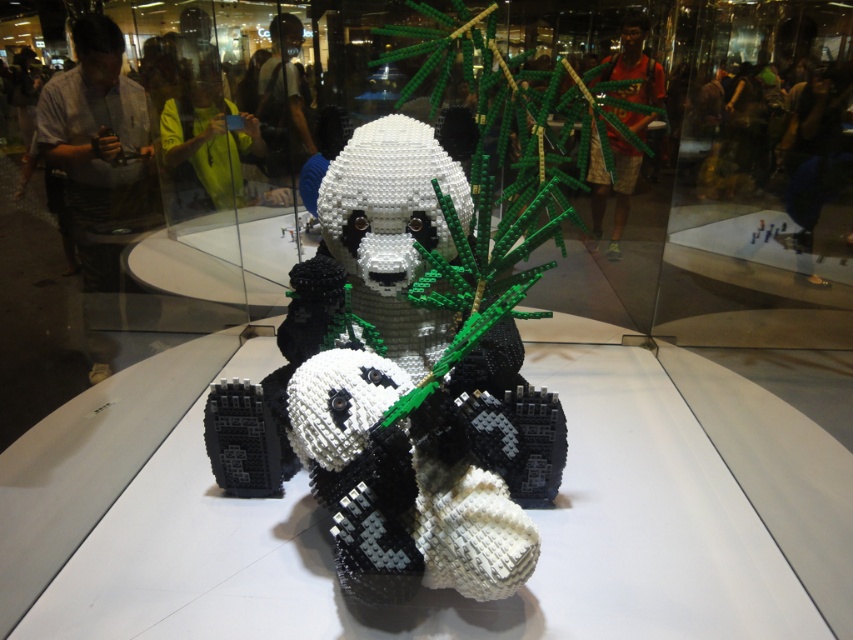
Question: Considering the relative positions of white matte lego panda at center and black matte lego panda at center in the image provided, where is white matte lego panda at center located with respect to black matte lego panda at center?

Choices:
 (A) above
 (B) below

Answer: (A)

Question: Can you confirm if white matte lego panda at center is positioned below black matte lego panda at center?

Choices:
 (A) no
 (B) yes

Answer: (A)

Question: Where is white matte lego panda at center located in relation to black matte lego panda at center in the image?

Choices:
 (A) below
 (B) above

Answer: (B)